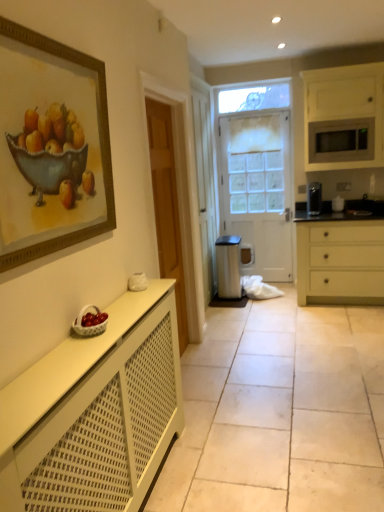
Question: From the image's perspective, is white matte microwave at upper right, the 1th cabinetry viewed from the top, on top of white frosted glass door at center?

Choices:
 (A) yes
 (B) no

Answer: (A)

Question: Is white matte microwave at upper right, the 2th cabinetry from the front, to the right of white frosted glass door at center from the viewer's perspective?

Choices:
 (A) no
 (B) yes

Answer: (B)

Question: Can you confirm if white matte microwave at upper right, acting as the 1th cabinetry starting from the right, is bigger than white frosted glass door at center?

Choices:
 (A) no
 (B) yes

Answer: (A)

Question: Is white frosted glass door at center at the back of white matte microwave at upper right, the 2th cabinetry from the front?

Choices:
 (A) yes
 (B) no

Answer: (B)

Question: Is white matte microwave at upper right, the 1th cabinetry in the back-to-front sequence, to the left of white frosted glass door at center from the viewer's perspective?

Choices:
 (A) no
 (B) yes

Answer: (A)

Question: Is point tap(236, 174) closer or farther from the camera than point tap(153, 385)?

Choices:
 (A) closer
 (B) farther

Answer: (B)

Question: Is white frosted glass door at center taller or shorter than white matte radiator at lower left, the first cabinetry in the front-to-back sequence?

Choices:
 (A) short
 (B) tall

Answer: (B)

Question: Considering the positions of white frosted glass door at center and white matte radiator at lower left, the first cabinetry in the front-to-back sequence, in the image, is white frosted glass door at center wider or thinner than white matte radiator at lower left, the first cabinetry in the front-to-back sequence,?

Choices:
 (A) thin
 (B) wide

Answer: (A)

Question: Is white frosted glass door at center in front of or behind white matte radiator at lower left, which is the 2th cabinetry in back-to-front order, in the image?

Choices:
 (A) front
 (B) behind

Answer: (B)

Question: In terms of size, does satin silver trash can at center appear bigger or smaller than white frosted glass door at center?

Choices:
 (A) small
 (B) big

Answer: (A)

Question: In terms of height, does satin silver trash can at center look taller or shorter compared to white frosted glass door at center?

Choices:
 (A) short
 (B) tall

Answer: (A)

Question: In terms of width, does satin silver trash can at center look wider or thinner when compared to white frosted glass door at center?

Choices:
 (A) wide
 (B) thin

Answer: (A)

Question: Considering the relative positions of satin silver trash can at center and white frosted glass door at center in the image provided, is satin silver trash can at center to the left or to the right of white frosted glass door at center?

Choices:
 (A) right
 (B) left

Answer: (B)

Question: Is white matte radiator at lower left, which ranks as the first cabinetry in left-to-right order, wider or thinner than matte silver microwave at upper right?

Choices:
 (A) wide
 (B) thin

Answer: (B)

Question: Do you think white matte radiator at lower left, acting as the 1th cabinetry starting from the bottom, is within matte silver microwave at upper right, or outside of it?

Choices:
 (A) inside
 (B) outside

Answer: (B)